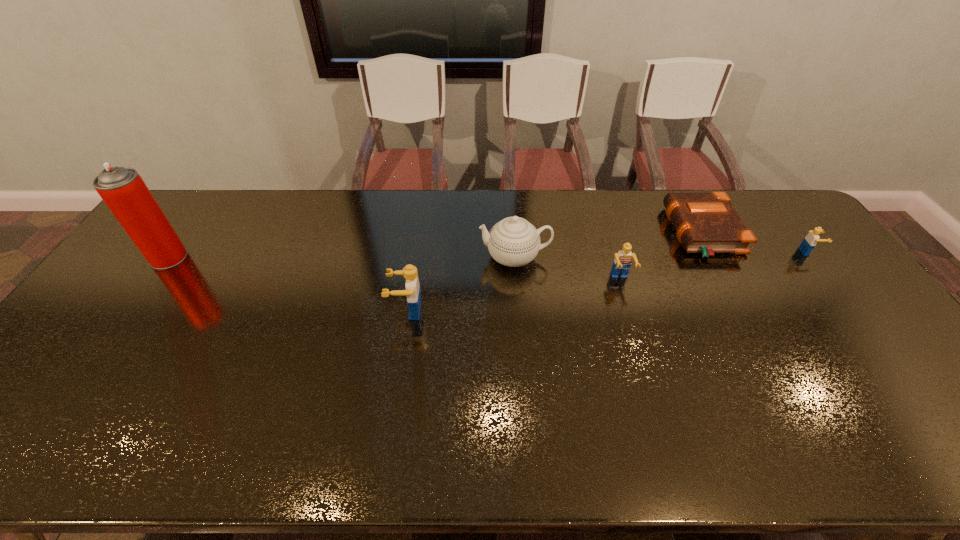
Identify the location of the tallest Lego. The height and width of the screenshot is (540, 960). (413, 291).

Identify the location of the leftmost Lego. (413, 291).

Where is `the second Lego from left to right`? Image resolution: width=960 pixels, height=540 pixels. the second Lego from left to right is located at coordinates (623, 259).

Locate an element on the screen. the second farthest Lego is located at coordinates (623, 259).

Image resolution: width=960 pixels, height=540 pixels. What are the coordinates of `the second shortest object` in the screenshot? It's located at (809, 242).

Find the location of `the rightmost Lego`. the rightmost Lego is located at coordinates (809, 242).

Where is `aerosol can`? The height and width of the screenshot is (540, 960). aerosol can is located at coordinates pyautogui.click(x=122, y=189).

The width and height of the screenshot is (960, 540). I want to click on the tallest object, so click(122, 189).

Where is `the third object from left to right`? This screenshot has height=540, width=960. the third object from left to right is located at coordinates (513, 241).

Locate an element on the screen. This screenshot has height=540, width=960. the second object from right to left is located at coordinates (707, 223).